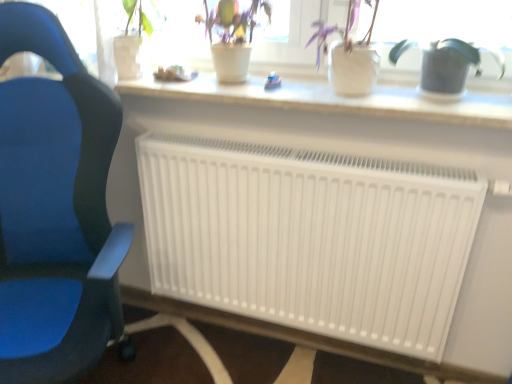
Question: Is point (227, 301) positioned closer to the camera than point (441, 87)?

Choices:
 (A) farther
 (B) closer

Answer: (A)

Question: Based on their sizes in the image, would you say white matte radiator at center is bigger or smaller than green matte watering can at right, which is the 1th houseplant in right-to-left order?

Choices:
 (A) small
 (B) big

Answer: (B)

Question: Based on their relative distances, which object is farther from the green matte watering can at right, which is the 1th houseplant in right-to-left order?

Choices:
 (A) blue fabric chair at left
 (B) white matte pot at upper center, the second houseplant viewed from the right
 (C) white matte radiator at center
 (D) green matte plant at upper center, the 3th houseplant from the right

Answer: (A)

Question: Based on their relative distances, which object is farther from the blue fabric chair at left?

Choices:
 (A) green matte watering can at right, which is the third houseplant in left-to-right order
 (B) green matte plant at upper center, the 3th houseplant from the right
 (C) white matte radiator at center
 (D) white matte pot at upper center, which appears as the second houseplant when viewed from the left

Answer: (A)